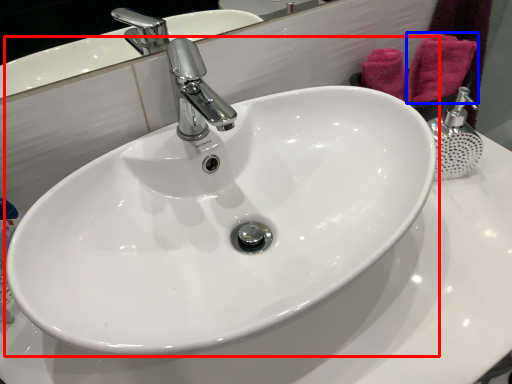
Question: Among these objects, which one is nearest to the camera, sink (highlighted by a red box) or bath towel (highlighted by a blue box)?

Choices:
 (A) sink
 (B) bath towel

Answer: (A)